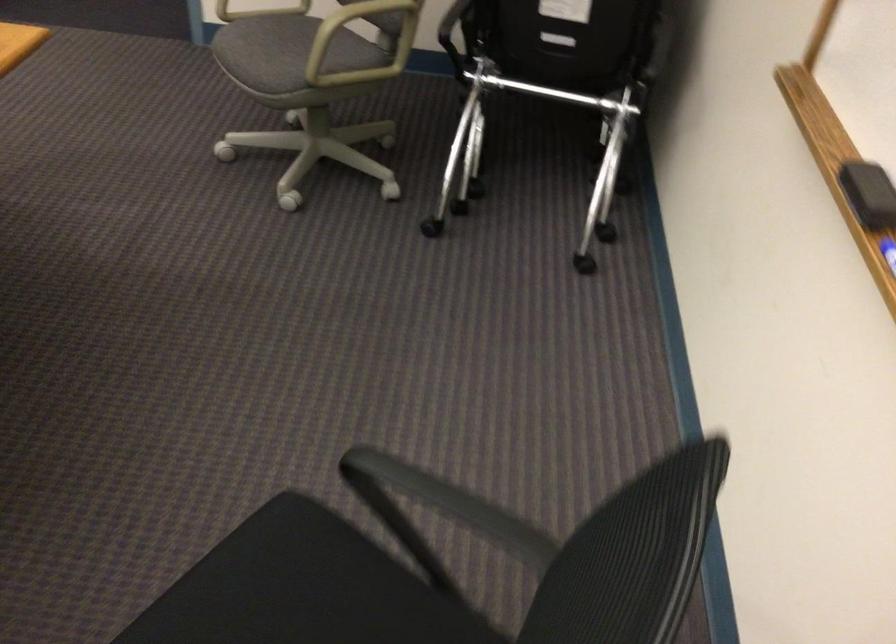
I want to click on black whiteboard eraser, so click(x=867, y=194).